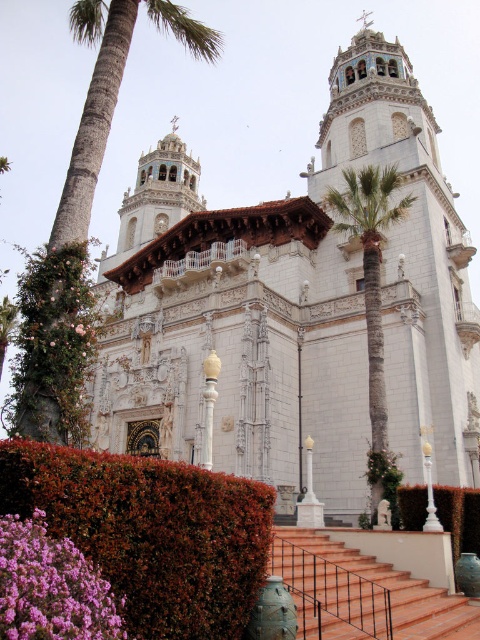
Is green leafy hedge at lower left behind purple matte flower at lower left?

Yes, it is.

Which is above, green leafy hedge at lower left or purple matte flower at lower left?

green leafy hedge at lower left is above.

The image size is (480, 640). What are the coordinates of `green leafy hedge at lower left` in the screenshot? It's located at (151, 532).

Who is higher up, green leafy palm tree at left or green leafy palm tree at center?

Positioned higher is green leafy palm tree at left.

Can you confirm if green leafy palm tree at left is smaller than green leafy palm tree at center?

Incorrect, green leafy palm tree at left is not smaller in size than green leafy palm tree at center.

Between point (86, 179) and point (361, 182), which one is positioned in front?

Positioned in front is point (86, 179).

Where is `green leafy palm tree at left`? The height and width of the screenshot is (640, 480). green leafy palm tree at left is located at coordinates (81, 228).

Describe the element at coordinates (297, 308) in the screenshot. I see `white stone church at center` at that location.

You are a GUI agent. You are given a task and a screenshot of the screen. Output one action in this format:
    pyautogui.click(x=<x>, y=<y>)
    Task: Click on the white stone church at center
    The height and width of the screenshot is (640, 480).
    Given the screenshot: What is the action you would take?
    pyautogui.click(x=297, y=308)